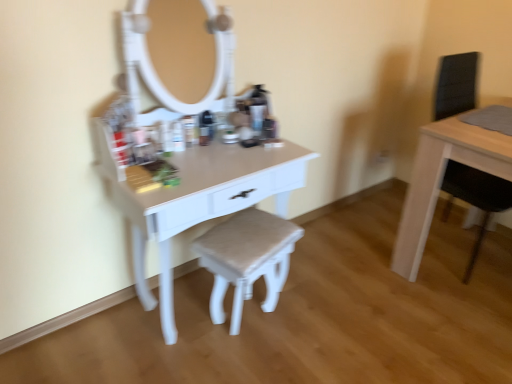
Question: In which direction should I rotate to look at white glossy table at center, which ranks as the 2th table in right-to-left order?

Choices:
 (A) left
 (B) right

Answer: (A)

Question: From the image's perspective, is matte white stool at center under light wood table at right, the 2th table in the left-to-right sequence?

Choices:
 (A) no
 (B) yes

Answer: (B)

Question: Is matte white stool at center facing away from light wood table at right, acting as the first table starting from the right?

Choices:
 (A) no
 (B) yes

Answer: (A)

Question: Can you confirm if matte white stool at center is bigger than light wood table at right, the 2th table in the left-to-right sequence?

Choices:
 (A) yes
 (B) no

Answer: (B)

Question: Can we say matte white stool at center lies outside light wood table at right, the 2th table in the left-to-right sequence?

Choices:
 (A) no
 (B) yes

Answer: (B)

Question: Is matte white stool at center positioned far away from light wood table at right, acting as the first table starting from the right?

Choices:
 (A) no
 (B) yes

Answer: (A)

Question: Is matte white stool at center to the left of light wood table at right, acting as the first table starting from the right, from the viewer's perspective?

Choices:
 (A) no
 (B) yes

Answer: (B)

Question: From the image's perspective, would you say light wood table at right, acting as the first table starting from the right, is shown under white glossy table at center, which ranks as the 2th table in right-to-left order?

Choices:
 (A) no
 (B) yes

Answer: (A)

Question: Is white glossy table at center, marked as the 1th table in a left-to-right arrangement, at the back of light wood table at right, the 2th table in the left-to-right sequence?

Choices:
 (A) no
 (B) yes

Answer: (A)

Question: Considering the relative sizes of light wood table at right, the 2th table in the left-to-right sequence, and white glossy table at center, marked as the 1th table in a left-to-right arrangement, in the image provided, is light wood table at right, the 2th table in the left-to-right sequence, bigger than white glossy table at center, marked as the 1th table in a left-to-right arrangement,?

Choices:
 (A) yes
 (B) no

Answer: (B)

Question: Is light wood table at right, acting as the first table starting from the right, directly adjacent to white glossy table at center, marked as the 1th table in a left-to-right arrangement?

Choices:
 (A) yes
 (B) no

Answer: (B)

Question: Is light wood table at right, the 2th table in the left-to-right sequence, thinner than white glossy table at center, marked as the 1th table in a left-to-right arrangement?

Choices:
 (A) no
 (B) yes

Answer: (A)

Question: Is light wood table at right, the 2th table in the left-to-right sequence, positioned beyond the bounds of white glossy table at center, which ranks as the 2th table in right-to-left order?

Choices:
 (A) yes
 (B) no

Answer: (A)

Question: Is white glossy table at center, which ranks as the 2th table in right-to-left order, not close to matte white stool at center?

Choices:
 (A) no
 (B) yes

Answer: (A)